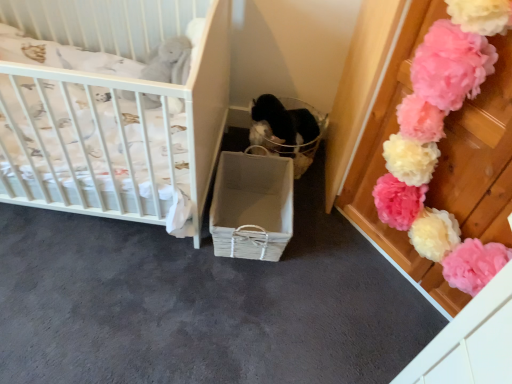
Image resolution: width=512 pixels, height=384 pixels. Identify the location of vacant region in front of white wicker basket at center. (234, 303).